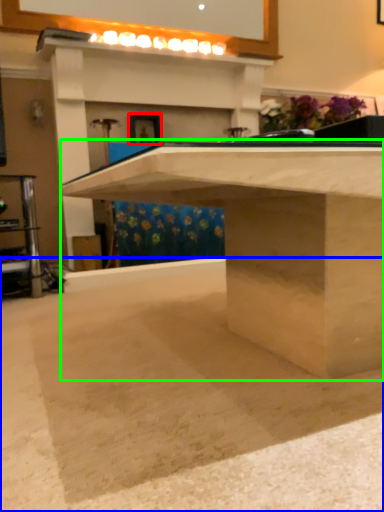
Question: Estimate the real-world distances between objects in this image. Which object is closer to picture frame (highlighted by a red box), concrete (highlighted by a blue box) or table (highlighted by a green box)?

Choices:
 (A) concrete
 (B) table

Answer: (B)